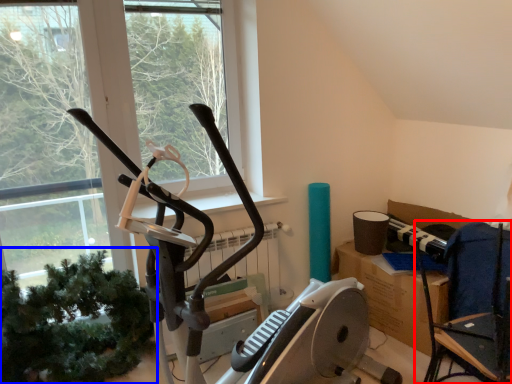
Question: Which object appears closest to the camera in this image, chair (highlighted by a red box) or plant (highlighted by a blue box)?

Choices:
 (A) chair
 (B) plant

Answer: (A)